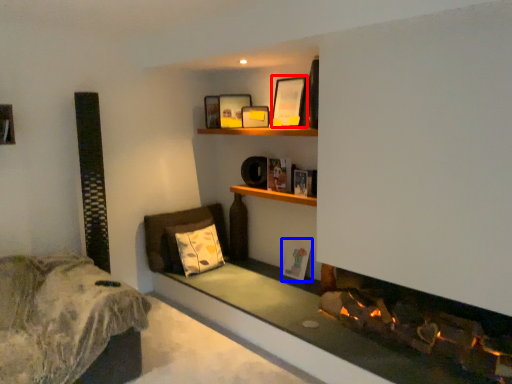
Question: Among these objects, which one is nearest to the camera, picture frame (highlighted by a red box) or picture frame (highlighted by a blue box)?

Choices:
 (A) picture frame
 (B) picture frame

Answer: (A)